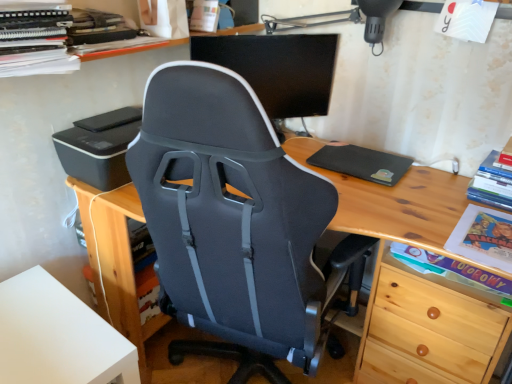
You are a GUI agent. You are given a task and a screenshot of the screen. Output one action in this format:
    pyautogui.click(x=<x>, y=<y>)
    Task: Click on the free spot above matte cardboard book at lower right, placed as the 1th book when sorted from bottom to top (from a real-world perspective)
    
    Given the screenshot: What is the action you would take?
    pyautogui.click(x=453, y=266)